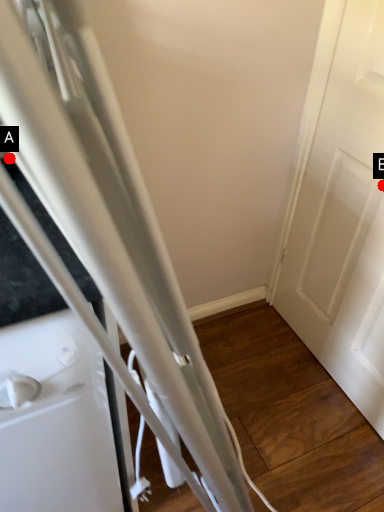
Question: Two points are circled on the image, labeled by A and B beside each circle. Among these points, which one is farthest from the camera?

Choices:
 (A) A is further
 (B) B is further

Answer: (B)